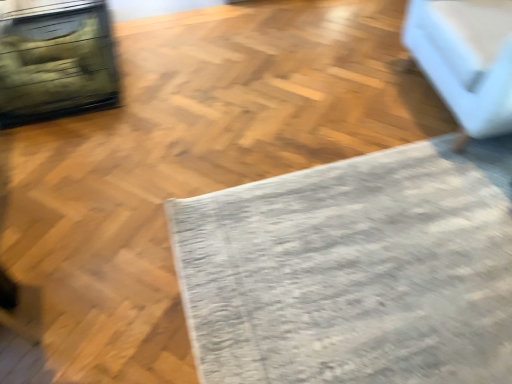
Locate an element on the screen. Image resolution: width=512 pixels, height=384 pixels. free area behind gray textured mat at center is located at coordinates (289, 78).